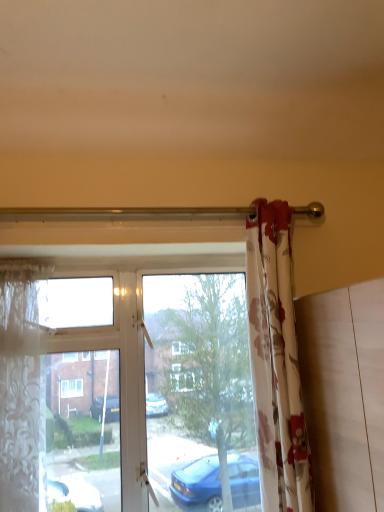
This screenshot has height=512, width=384. What do you see at coordinates (81, 395) in the screenshot?
I see `transparent glass window at center` at bounding box center [81, 395].

What do you see at coordinates (21, 388) in the screenshot? This screenshot has height=512, width=384. I see `translucent floral fabric at left, the first curtain when ordered from left to right` at bounding box center [21, 388].

The image size is (384, 512). In order to click on floral fabric curtain at right, the 2th curtain from the left in this screenshot , I will do `click(276, 362)`.

I want to click on transparent glass window at center, so click(x=81, y=395).

From the picture: From a real-world perspective, is floral fabric curtain at right, the 2th curtain from the left, positioned above or below translucent floral fabric at left, arranged as the 2th curtain when viewed from the right?

In terms of real-world spatial position, floral fabric curtain at right, the 2th curtain from the left, is above translucent floral fabric at left, arranged as the 2th curtain when viewed from the right.

Is floral fabric curtain at right, the 2th curtain from the left, to the left or to the right of translucent floral fabric at left, the first curtain when ordered from left to right, in the image?

Clearly, floral fabric curtain at right, the 2th curtain from the left, is on the right of translucent floral fabric at left, the first curtain when ordered from left to right, in the image.

From the picture: Is floral fabric curtain at right, placed as the first curtain when sorted from right to left, smaller than translucent floral fabric at left, arranged as the 2th curtain when viewed from the right?

Actually, floral fabric curtain at right, placed as the first curtain when sorted from right to left, might be larger than translucent floral fabric at left, arranged as the 2th curtain when viewed from the right.

In the image, there is a floral fabric curtain at right, placed as the first curtain when sorted from right to left. Identify the location of curtain below it (from the image's perspective). (21, 388).

In the scene shown: From a real-world perspective, who is located higher, translucent floral fabric at left, arranged as the 2th curtain when viewed from the right, or floral fabric curtain at right, placed as the first curtain when sorted from right to left?

floral fabric curtain at right, placed as the first curtain when sorted from right to left.

Who is shorter, translucent floral fabric at left, the first curtain when ordered from left to right, or floral fabric curtain at right, placed as the first curtain when sorted from right to left?

translucent floral fabric at left, the first curtain when ordered from left to right.

How much distance is there between translucent floral fabric at left, arranged as the 2th curtain when viewed from the right, and floral fabric curtain at right, the 2th curtain from the left?

translucent floral fabric at left, arranged as the 2th curtain when viewed from the right, and floral fabric curtain at right, the 2th curtain from the left, are 29.37 inches apart from each other.

From the image's perspective, would you say translucent floral fabric at left, the first curtain when ordered from left to right, is shown under floral fabric curtain at right, placed as the first curtain when sorted from right to left?

Yes, from the image's perspective, translucent floral fabric at left, the first curtain when ordered from left to right, is below floral fabric curtain at right, placed as the first curtain when sorted from right to left.

Identify the location of curtain that is the 2nd object located above the transparent glass window at center (from the image's perspective). Image resolution: width=384 pixels, height=512 pixels. (276, 362).

Does transparent glass window at center appear on the right side of floral fabric curtain at right, the 2th curtain from the left?

No, transparent glass window at center is not to the right of floral fabric curtain at right, the 2th curtain from the left.

Is transparent glass window at center next to floral fabric curtain at right, the 2th curtain from the left, and touching it?

There is a gap between transparent glass window at center and floral fabric curtain at right, the 2th curtain from the left.

Which is closer, (285,355) or (12,421)?

Clearly, point (285,355) is closer to the camera than point (12,421).

Considering the relative positions of transparent glass window at center and translucent floral fabric at left, the first curtain when ordered from left to right, in the image provided, is transparent glass window at center to the left or to the right of translucent floral fabric at left, the first curtain when ordered from left to right,?

From the image, it's evident that transparent glass window at center is to the right of translucent floral fabric at left, the first curtain when ordered from left to right.

Are transparent glass window at center and translucent floral fabric at left, arranged as the 2th curtain when viewed from the right, located far from each other?

That's not correct — transparent glass window at center is a little close to translucent floral fabric at left, arranged as the 2th curtain when viewed from the right.

Which is behind, point (29, 448) or point (288, 407)?

The point (29, 448) is farther.

From the picture: Is translucent floral fabric at left, arranged as the 2th curtain when viewed from the right, next to transparent glass window at center and touching it?

No.

Considering the relative sizes of translucent floral fabric at left, arranged as the 2th curtain when viewed from the right, and transparent glass window at center in the image provided, is translucent floral fabric at left, arranged as the 2th curtain when viewed from the right, thinner than transparent glass window at center?

In fact, translucent floral fabric at left, arranged as the 2th curtain when viewed from the right, might be wider than transparent glass window at center.

Can you tell me how much translucent floral fabric at left, arranged as the 2th curtain when viewed from the right, and transparent glass window at center differ in facing direction?

The angle between the facing direction of translucent floral fabric at left, arranged as the 2th curtain when viewed from the right, and the facing direction of transparent glass window at center is 1.24 degrees.

What's the angular difference between floral fabric curtain at right, placed as the first curtain when sorted from right to left, and transparent glass window at center's facing directions?

floral fabric curtain at right, placed as the first curtain when sorted from right to left, and transparent glass window at center are facing 1.5 degrees away from each other.

Based on the photo, does floral fabric curtain at right, the 2th curtain from the left, come in front of transparent glass window at center?

That is True.

Identify the location of window that is under the floral fabric curtain at right, placed as the first curtain when sorted from right to left (from a real-world perspective). (81, 395).

Considering the relative sizes of floral fabric curtain at right, the 2th curtain from the left, and transparent glass window at center in the image provided, is floral fabric curtain at right, the 2th curtain from the left, smaller than transparent glass window at center?

Yes.

Where is `curtain above the translucent floral fabric at left, the first curtain when ordered from left to right (from the image's perspective)`? curtain above the translucent floral fabric at left, the first curtain when ordered from left to right (from the image's perspective) is located at coordinates (276, 362).

In order to click on curtain on the left of floral fabric curtain at right, placed as the first curtain when sorted from right to left in this screenshot , I will do `click(21, 388)`.

Estimate the real-world distances between objects in this image. Which object is closer to floral fabric curtain at right, placed as the first curtain when sorted from right to left, transparent glass window at center or translucent floral fabric at left, the first curtain when ordered from left to right?

transparent glass window at center is closer to floral fabric curtain at right, placed as the first curtain when sorted from right to left.

From the image, which object appears to be farther from translucent floral fabric at left, the first curtain when ordered from left to right, floral fabric curtain at right, the 2th curtain from the left, or transparent glass window at center?

Among the two, floral fabric curtain at right, the 2th curtain from the left, is located further to translucent floral fabric at left, the first curtain when ordered from left to right.

From the image, which object appears to be farther from floral fabric curtain at right, placed as the first curtain when sorted from right to left, translucent floral fabric at left, the first curtain when ordered from left to right, or transparent glass window at center?

The object further to floral fabric curtain at right, placed as the first curtain when sorted from right to left, is translucent floral fabric at left, the first curtain when ordered from left to right.

When comparing their distances from transparent glass window at center, does floral fabric curtain at right, the 2th curtain from the left, or translucent floral fabric at left, the first curtain when ordered from left to right, seem closer?

floral fabric curtain at right, the 2th curtain from the left, is positioned closer to the anchor transparent glass window at center.

When comparing their distances from transparent glass window at center, does translucent floral fabric at left, the first curtain when ordered from left to right, or floral fabric curtain at right, the 2th curtain from the left, seem closer?

Among the two, floral fabric curtain at right, the 2th curtain from the left, is located nearer to transparent glass window at center.

From the image, which object appears to be nearer to translucent floral fabric at left, arranged as the 2th curtain when viewed from the right, transparent glass window at center or floral fabric curtain at right, the 2th curtain from the left?

Among the two, transparent glass window at center is located nearer to translucent floral fabric at left, arranged as the 2th curtain when viewed from the right.

I want to click on window between translucent floral fabric at left, arranged as the 2th curtain when viewed from the right, and floral fabric curtain at right, placed as the first curtain when sorted from right to left, in the horizontal direction, so click(81, 395).